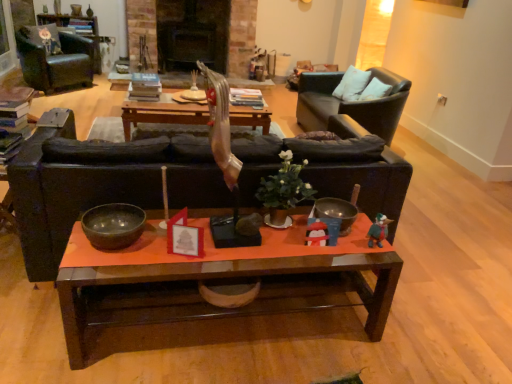
You are a GUI agent. You are given a task and a screenshot of the screen. Output one action in this format:
    pyautogui.click(x=<x>, y=<y>)
    Task: Click on the free area below shiny dark wood bowl at center, marked as the first bowl in a left-to-right arrangement (from a real-world perspective)
    
    Given the screenshot: What is the action you would take?
    pyautogui.click(x=114, y=246)